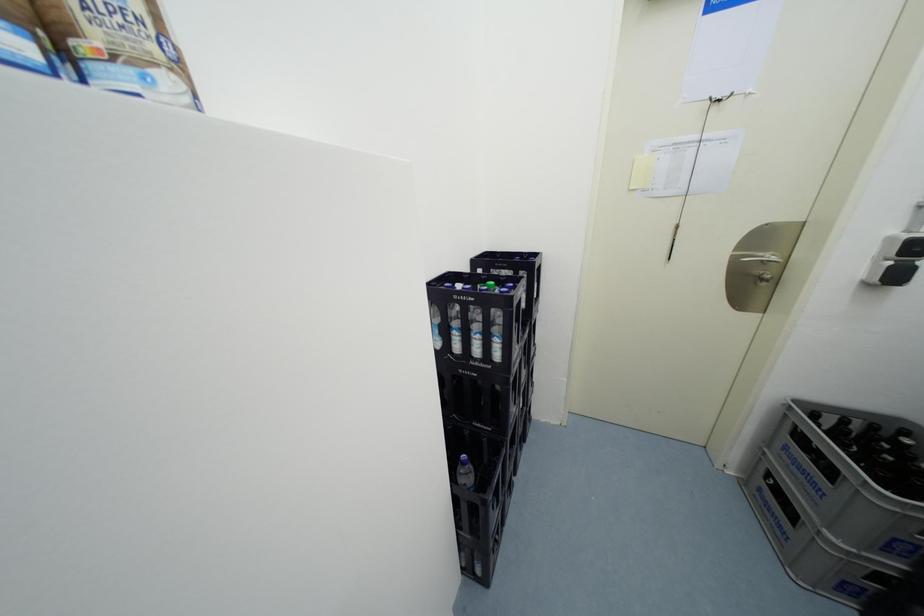
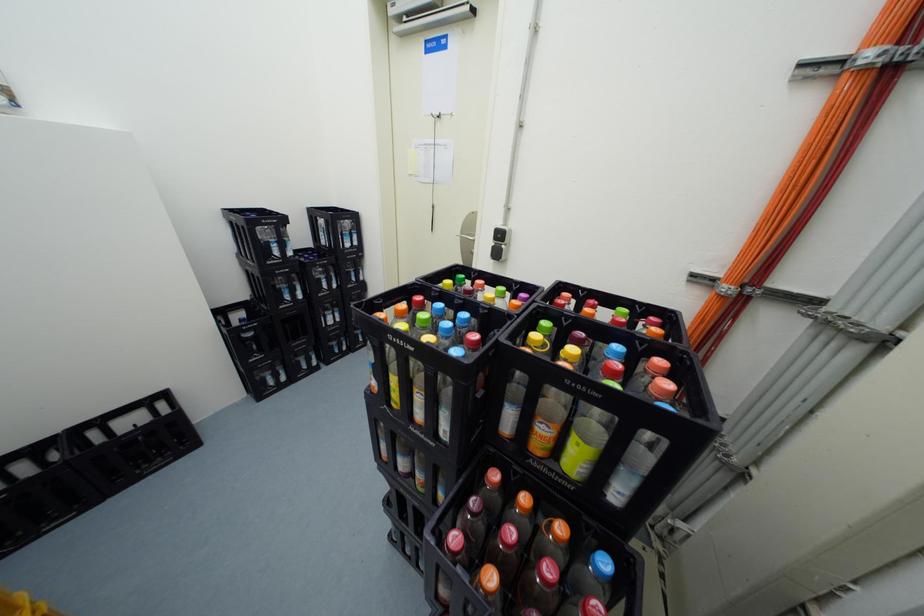
Question: What movement of the cameraman would produce the second image?

Choices:
 (A) Left
 (B) Right
 (C) Forward
 (D) Backward

Answer: (B)